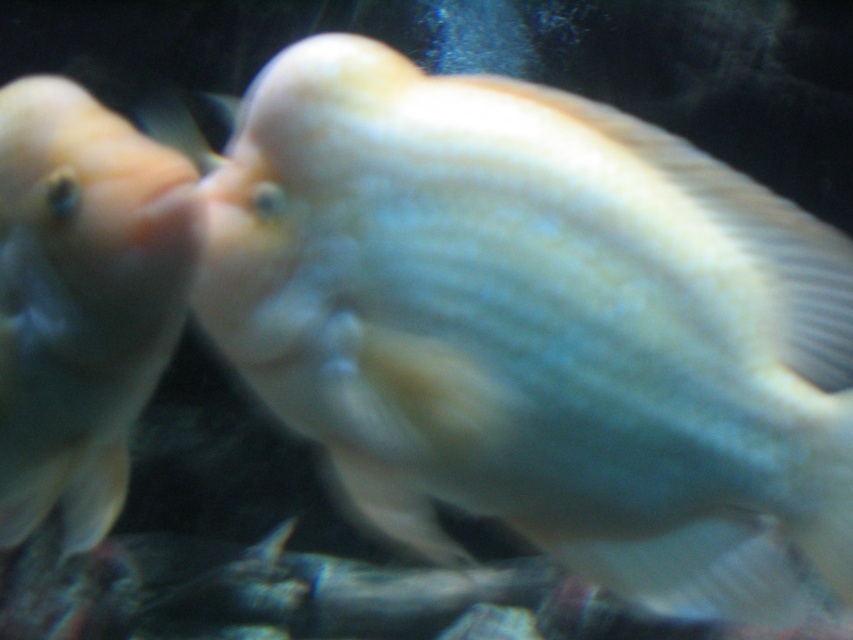
Who is more distant from viewer, (605, 563) or (144, 369)?

Positioned behind is point (144, 369).

Does smooth white fish at center appear on the left side of matte white fish at left?

No, smooth white fish at center is not to the left of matte white fish at left.

Locate an element on the screen. This screenshot has width=853, height=640. smooth white fish at center is located at coordinates (538, 324).

The height and width of the screenshot is (640, 853). Identify the location of smooth white fish at center. click(538, 324).